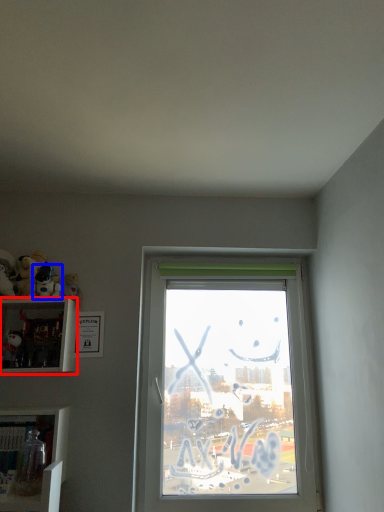
Question: Which point is closer to the camera, shelf (highlighted by a red box) or toy (highlighted by a blue box)?

Choices:
 (A) shelf
 (B) toy

Answer: (A)